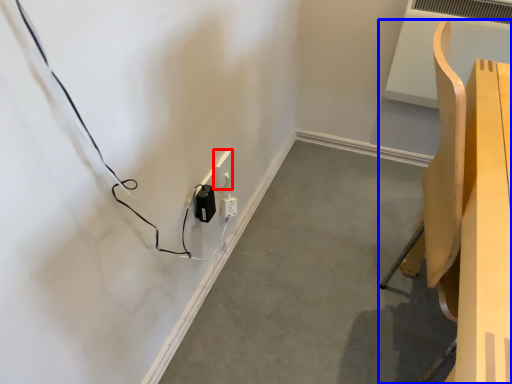
Question: Which point is closer to the camera, electric outlet (highlighted by a red box) or furniture (highlighted by a blue box)?

Choices:
 (A) electric outlet
 (B) furniture

Answer: (B)